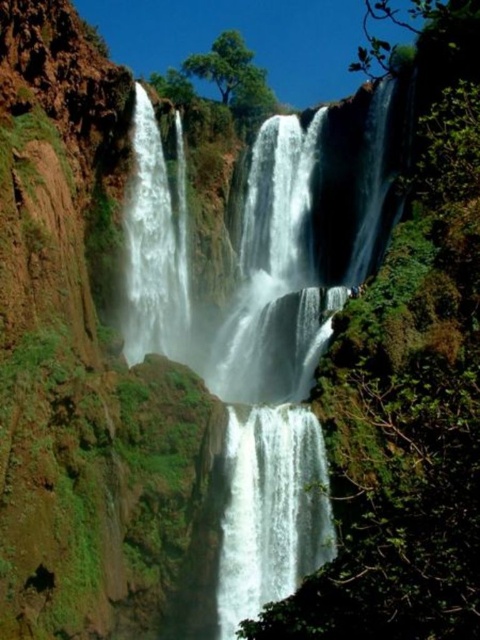
Question: Does white smooth waterfall at center have a greater width compared to white smooth waterfall at left?

Choices:
 (A) no
 (B) yes

Answer: (B)

Question: Is white water at center to the left of white smooth waterfall at center from the viewer's perspective?

Choices:
 (A) no
 (B) yes

Answer: (B)

Question: Estimate the real-world distances between objects in this image. Which object is farther from the white smooth waterfall at center?

Choices:
 (A) white smooth waterfall at left
 (B) white water at center

Answer: (A)

Question: Among these points, which one is farthest from the camera?

Choices:
 (A) (186, 276)
 (B) (340, 204)

Answer: (B)

Question: Is white water at center further to the viewer compared to white smooth waterfall at left?

Choices:
 (A) no
 (B) yes

Answer: (A)

Question: Among these objects, which one is nearest to the camera?

Choices:
 (A) white water at center
 (B) white smooth waterfall at center

Answer: (B)